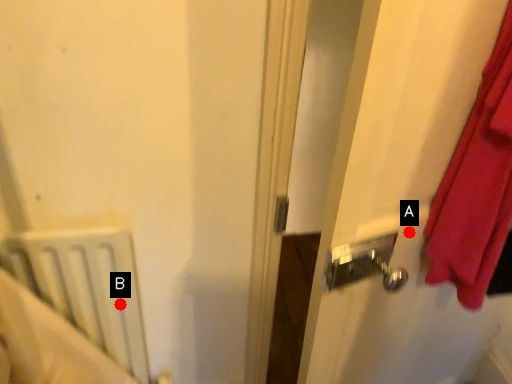
Question: Two points are circled on the image, labeled by A and B beside each circle. Which point is farther from the camera taking this photo?

Choices:
 (A) A is further
 (B) B is further

Answer: (B)